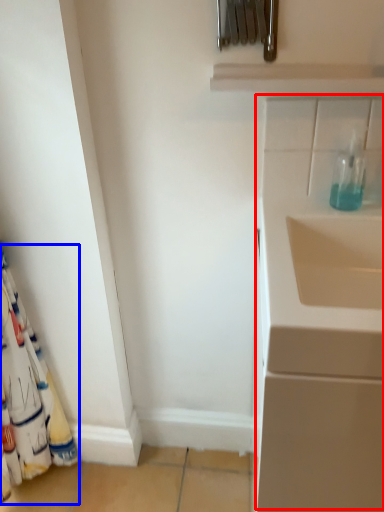
Question: Among these objects, which one is nearest to the camera, wide (highlighted by a red box) or curtain (highlighted by a blue box)?

Choices:
 (A) wide
 (B) curtain

Answer: (A)